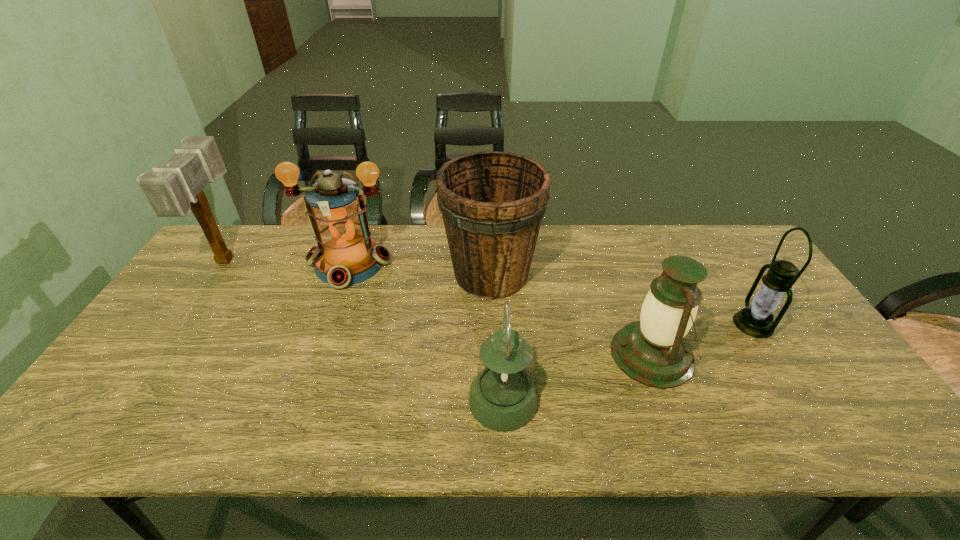
The height and width of the screenshot is (540, 960). I want to click on vacant area between the farthest lantern and the rightmost object, so click(551, 294).

Where is `free space between the leftmost object and the second object from right to left`? free space between the leftmost object and the second object from right to left is located at coordinates (439, 307).

Where is `vacant space that's between the third lantern from right to left and the mallet`? This screenshot has width=960, height=540. vacant space that's between the third lantern from right to left and the mallet is located at coordinates (365, 330).

This screenshot has width=960, height=540. Find the location of `vacant region between the third lantern from left to right and the third lantern from right to left`. vacant region between the third lantern from left to right and the third lantern from right to left is located at coordinates (578, 377).

Locate an element on the screen. This screenshot has height=540, width=960. the third closest object to the second object from right to left is located at coordinates (503, 397).

Point out which object is positioned as the nearest to the mallet. Please provide its 2D coordinates. Your answer should be formatted as a tuple, i.e. [(x, y)], where the tuple contains the x and y coordinates of a point satisfying the conditions above.

[(345, 255)]

Select which lantern is the closest to the rightmost lantern. Please provide its 2D coordinates. Your answer should be formatted as a tuple, i.e. [(x, y)], where the tuple contains the x and y coordinates of a point satisfying the conditions above.

[(653, 351)]

At what (x,y) coordinates should I click in order to perform the action: click on lantern that stands as the second closest to the rightmost lantern. Please return your answer as a coordinate pair (x, y). The image size is (960, 540). Looking at the image, I should click on (503, 397).

Identify the location of vacant point that satisfies the following two spatial constraints: 1. on the front-facing side of the farthest lantern; 2. on the right side of the second lantern from left to right. (301, 401).

Identify the location of free location that satisfies the following two spatial constraints: 1. on the front-facing side of the fifth object from right to left; 2. on the right side of the bucket. (346, 274).